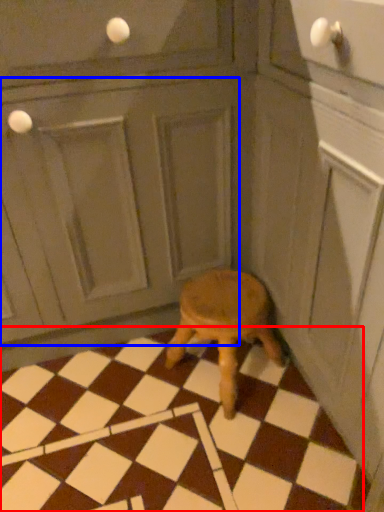
Question: Which of the following is the closest to the observer, tile (highlighted by a red box) or screen door (highlighted by a blue box)?

Choices:
 (A) tile
 (B) screen door

Answer: (B)